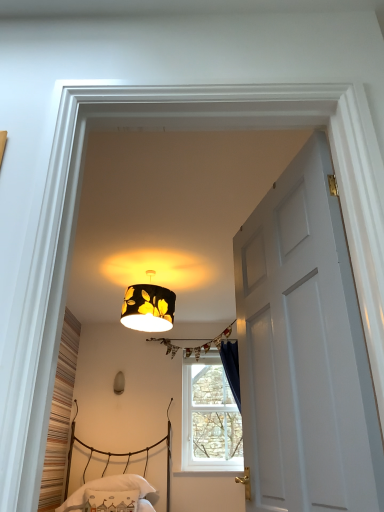
Image resolution: width=384 pixels, height=512 pixels. What are the coordinates of `empty space that is ontop of black fabric lampshade at center, marked as the first lamp in a front-to-back arrangement (from a real-world perspective)` in the screenshot? It's located at (155, 269).